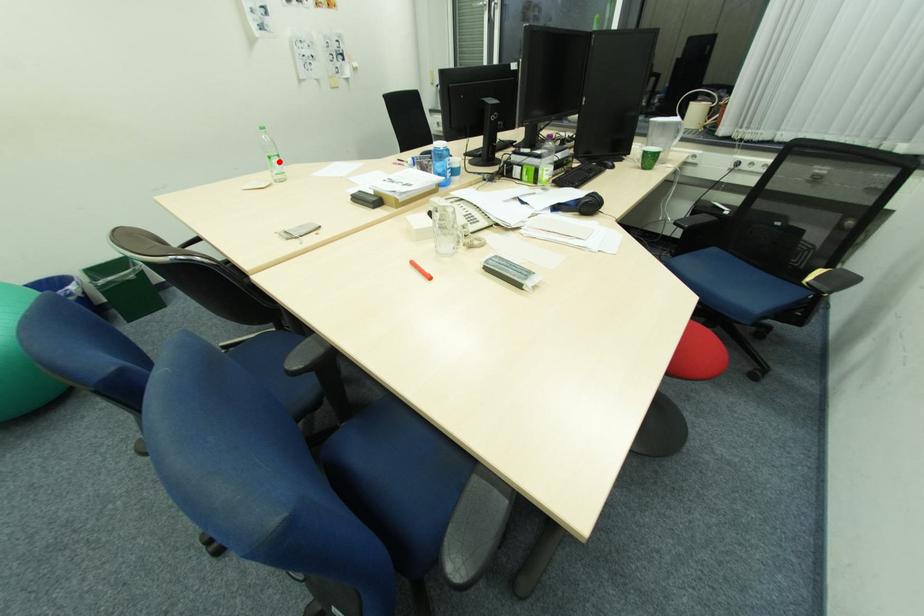
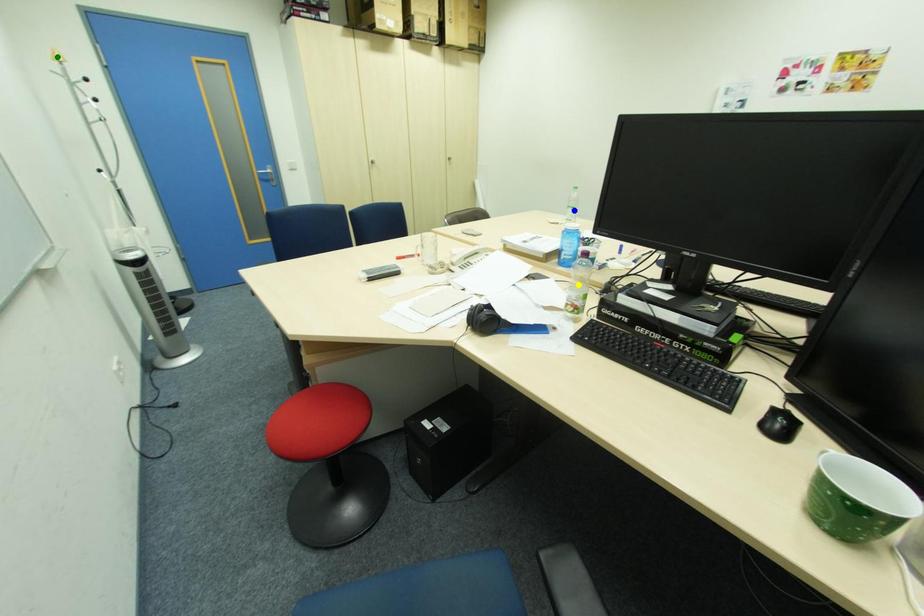
Question: I am providing you with two images of the same scene from different viewpoints. A red point is marked on the first image. You are given multiple points on the second image. Which point in image 2 is actually the same real-world point as the red point in image 1?

Choices:
 (A) green point
 (B) yellow point
 (C) blue point

Answer: (C)